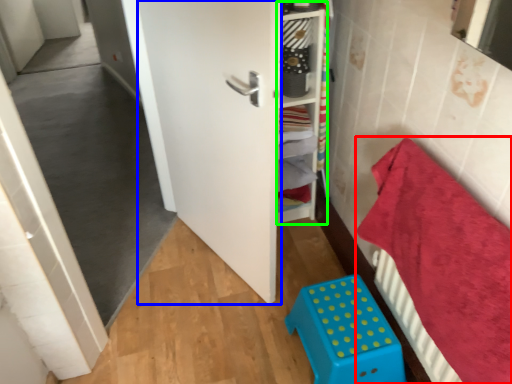
Question: Based on their relative distances, which object is farther from bedding (highlighted by a red box)? Choose from door (highlighted by a blue box) and shelf (highlighted by a green box).

Choices:
 (A) door
 (B) shelf

Answer: (B)